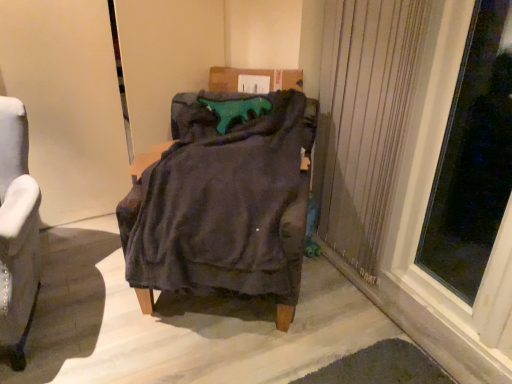
Question: Is velvet dark gray armchair at center at the right side of transparent glass window at right?

Choices:
 (A) no
 (B) yes

Answer: (A)

Question: Can you confirm if velvet dark gray armchair at center is positioned to the left of transparent glass window at right?

Choices:
 (A) yes
 (B) no

Answer: (A)

Question: Is velvet dark gray armchair at center facing away from transparent glass window at right?

Choices:
 (A) yes
 (B) no

Answer: (B)

Question: Is velvet dark gray armchair at center smaller than transparent glass window at right?

Choices:
 (A) no
 (B) yes

Answer: (A)

Question: Considering the relative sizes of velvet dark gray armchair at center and transparent glass window at right in the image provided, is velvet dark gray armchair at center taller than transparent glass window at right?

Choices:
 (A) yes
 (B) no

Answer: (B)

Question: Is velvet dark gray armchair at center touching transparent glass window at right?

Choices:
 (A) no
 (B) yes

Answer: (A)

Question: Is velvet gray armchair at left smaller than velvet dark gray armchair at center?

Choices:
 (A) no
 (B) yes

Answer: (B)

Question: Is velvet gray armchair at left oriented away from velvet dark gray armchair at center?

Choices:
 (A) no
 (B) yes

Answer: (A)

Question: Does velvet gray armchair at left have a lesser width compared to velvet dark gray armchair at center?

Choices:
 (A) yes
 (B) no

Answer: (A)

Question: From the image's perspective, would you say velvet gray armchair at left is shown under velvet dark gray armchair at center?

Choices:
 (A) no
 (B) yes

Answer: (B)

Question: Can you confirm if velvet gray armchair at left is bigger than velvet dark gray armchair at center?

Choices:
 (A) yes
 (B) no

Answer: (B)

Question: Is velvet dark gray armchair at center surrounded by velvet gray armchair at left?

Choices:
 (A) yes
 (B) no

Answer: (B)

Question: Is beige textured curtain at right shorter than transparent glass window at right?

Choices:
 (A) yes
 (B) no

Answer: (B)